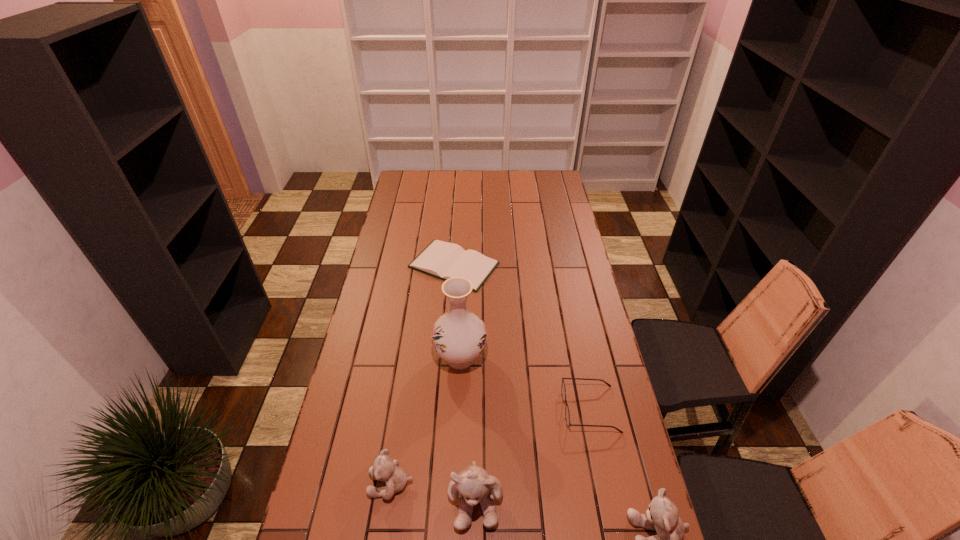
Where is `the fourth tallest object`? Image resolution: width=960 pixels, height=540 pixels. the fourth tallest object is located at coordinates (385, 469).

Where is `the leftmost teddy bear`? Image resolution: width=960 pixels, height=540 pixels. the leftmost teddy bear is located at coordinates (385, 469).

Locate an element on the screen. the second teddy bear from left to right is located at coordinates (473, 484).

Image resolution: width=960 pixels, height=540 pixels. I want to click on the farthest object, so click(443, 260).

This screenshot has width=960, height=540. What are the coordinates of `hardback book` in the screenshot? It's located at (443, 260).

The height and width of the screenshot is (540, 960). What are the coordinates of `spectacles` in the screenshot? It's located at (567, 415).

This screenshot has width=960, height=540. Identify the location of the fifth tallest object. (567, 415).

The height and width of the screenshot is (540, 960). I want to click on the second farthest object, so click(x=459, y=336).

Locate an element on the screen. The width and height of the screenshot is (960, 540). the tallest object is located at coordinates (459, 336).

Locate an element on the screen. The image size is (960, 540). free location located 0.090m on the face of the shortest teddy bear is located at coordinates (336, 484).